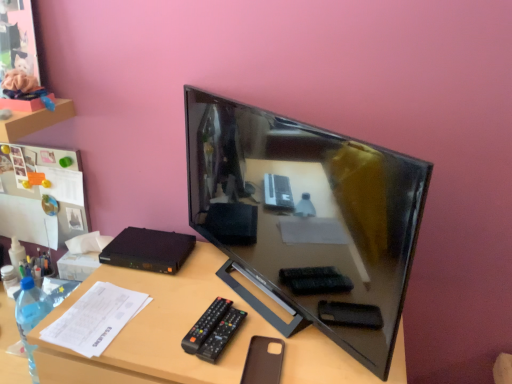
Identify the location of vacant space situated on the left part of black glossy television at center. (174, 295).